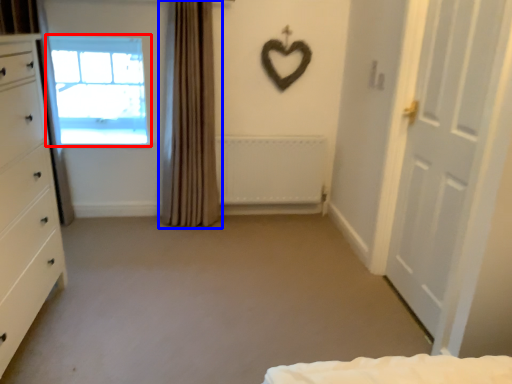
Question: Which object is further to the camera taking this photo, window (highlighted by a red box) or curtain (highlighted by a blue box)?

Choices:
 (A) window
 (B) curtain

Answer: (A)